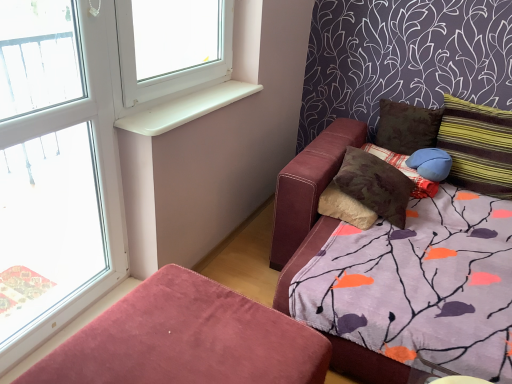
Question: Considering the positions of blue fabric pillow at upper right, placed as the 2th pillow when sorted from right to left, and brown fabric pillow at upper right, the 2th pillow viewed from the left, in the image, is blue fabric pillow at upper right, placed as the 2th pillow when sorted from right to left, bigger or smaller than brown fabric pillow at upper right, the 2th pillow viewed from the left,?

Choices:
 (A) big
 (B) small

Answer: (B)

Question: Is blue fabric pillow at upper right, placed as the 2th pillow when sorted from right to left, to the left or to the right of brown fabric pillow at upper right, placed as the third pillow when sorted from right to left, in the image?

Choices:
 (A) right
 (B) left

Answer: (A)

Question: Which object is the farthest from the striped fabric pillow at right, marked as the first pillow in a right-to-left arrangement?

Choices:
 (A) brown fabric pillow at upper right, the 2th pillow viewed from the left
 (B) velvet ottoman at lower left
 (C) blue fabric pillow at upper right, placed as the 2th pillow when sorted from right to left
 (D) clear glass window at left
 (E) white plastic window sill at upper left

Answer: (D)

Question: Which object is the farthest from the velvet ottoman at lower left?

Choices:
 (A) brown textured pillow at upper right, which is the fourth pillow from right to left
 (B) blue fabric pillow at upper right, placed as the 2th pillow when sorted from right to left
 (C) clear glass window at left
 (D) brown fabric pillow at upper right, the 2th pillow viewed from the left
 (E) striped fabric pillow at right, marked as the first pillow in a right-to-left arrangement

Answer: (D)